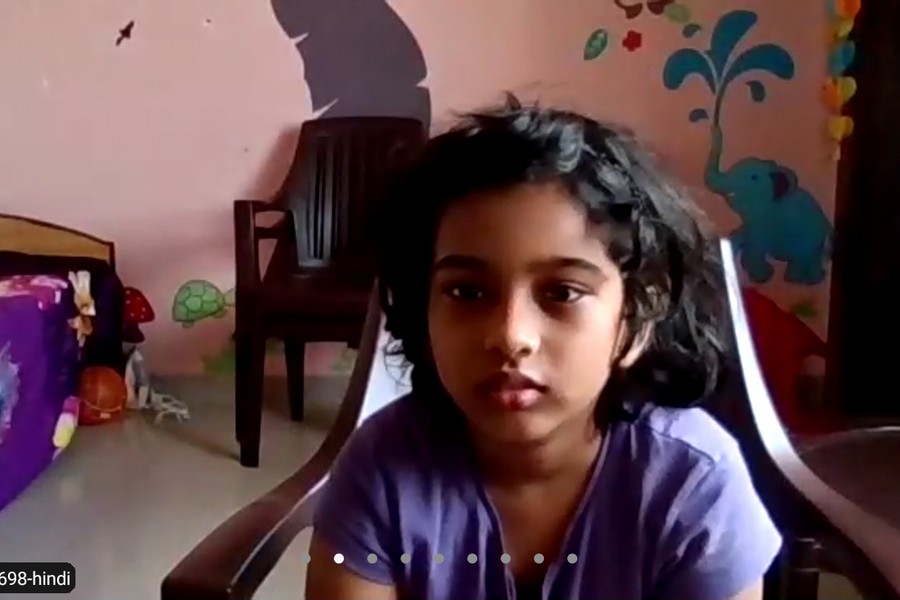
You are a GUI agent. You are given a task and a screenshot of the screen. Output one action in this format:
    pyautogui.click(x=<x>, y=<y>)
    Task: Click on the pink wall color
    
    Given the screenshot: What is the action you would take?
    pyautogui.click(x=177, y=112), pyautogui.click(x=508, y=48)